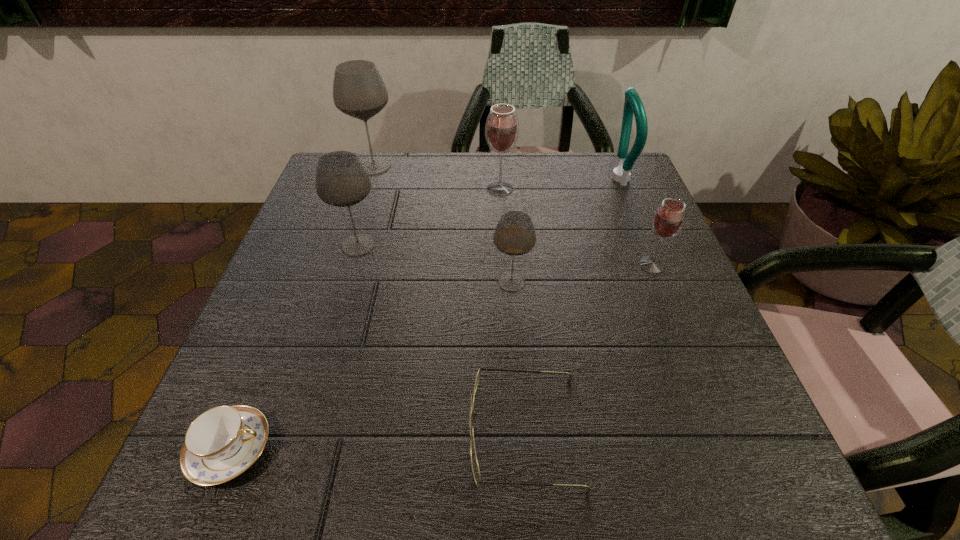
Image resolution: width=960 pixels, height=540 pixels. Identify the location of vacant area located 0.340m on the side with the handle of the blue teacup. (509, 449).

Identify the location of free space located on the front-facing side of the beige spectacles. (211, 432).

Locate an element on the screen. The image size is (960, 540). vacant space located 0.080m on the front-facing side of the beige spectacles is located at coordinates (416, 432).

Image resolution: width=960 pixels, height=540 pixels. I want to click on vacant position located on the front-facing side of the beige spectacles, so click(x=348, y=432).

You are a GUI agent. You are given a task and a screenshot of the screen. Output one action in this format:
    pyautogui.click(x=<x>, y=<y>)
    Task: Click on the bottle opener present at the far edge
    
    Given the screenshot: What is the action you would take?
    pyautogui.click(x=633, y=104)

Where is `teacup at the near edge`? The height and width of the screenshot is (540, 960). teacup at the near edge is located at coordinates (221, 443).

The image size is (960, 540). What are the coordinates of `spectacles at the near edge` in the screenshot? It's located at (474, 462).

You are a GUI agent. You are given a task and a screenshot of the screen. Output one action in this format:
    pyautogui.click(x=<x>, y=<y>)
    Task: Click on the teacup that is at the left edge
    The image size is (960, 540).
    Given the screenshot: What is the action you would take?
    pyautogui.click(x=221, y=443)

Locate an element on the screen. This screenshot has width=960, height=540. bottle opener that is at the right edge is located at coordinates (633, 104).

Locate an element on the screen. The image size is (960, 540). wineglass at the right edge is located at coordinates (668, 220).